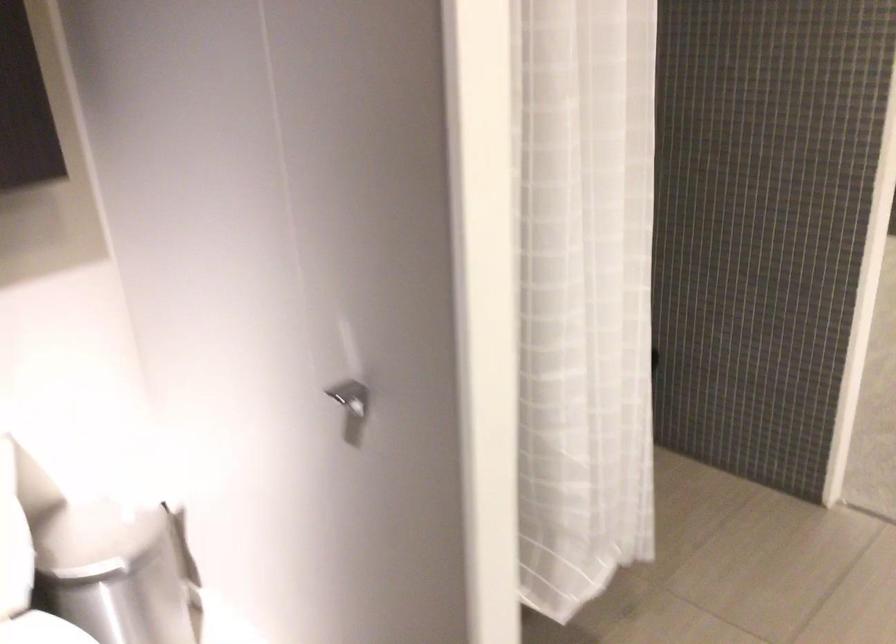
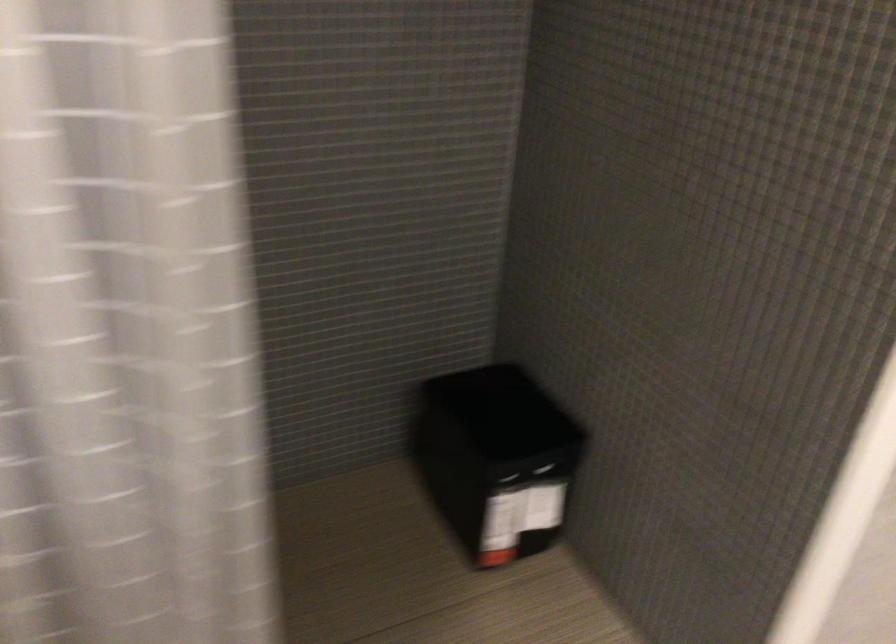
Question: The camera is either moving clockwise (left) or counter-clockwise (right) around the object. The first image is from the beginning of the video and the second image is from the end. Is the camera moving left or right when shooting the video?

Choices:
 (A) Left
 (B) Right

Answer: (B)